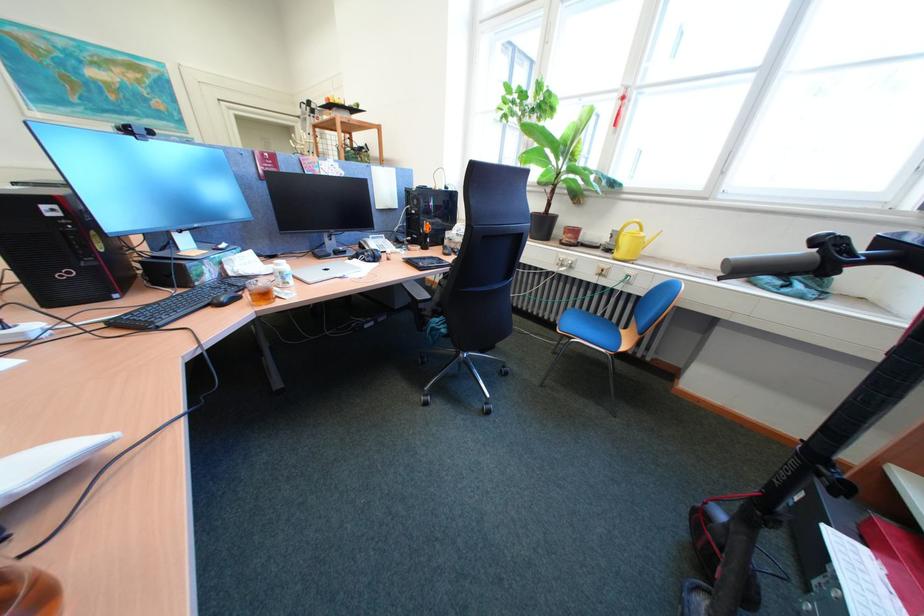
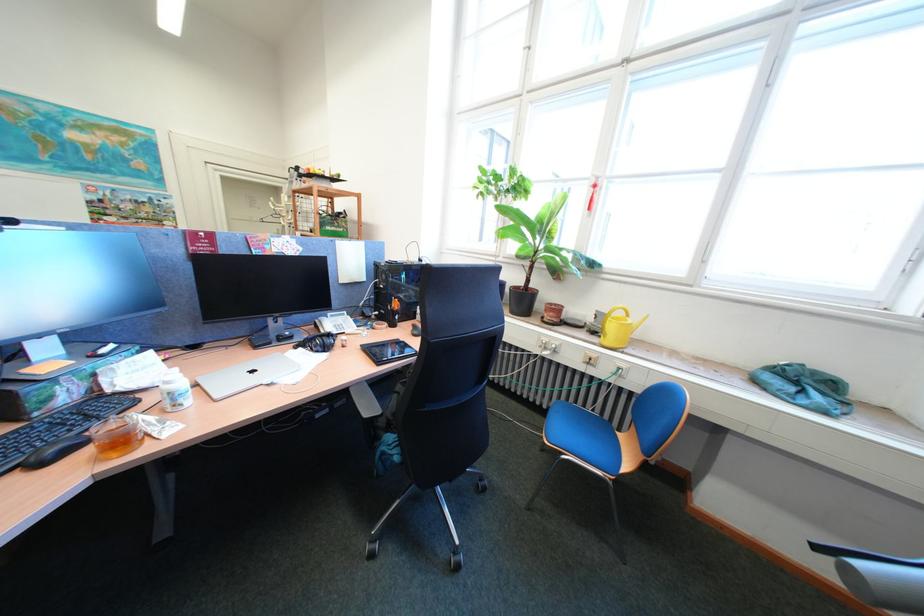
The point at (562,331) is marked in the first image. Where is the corresponding point in the second image?

(548, 416)